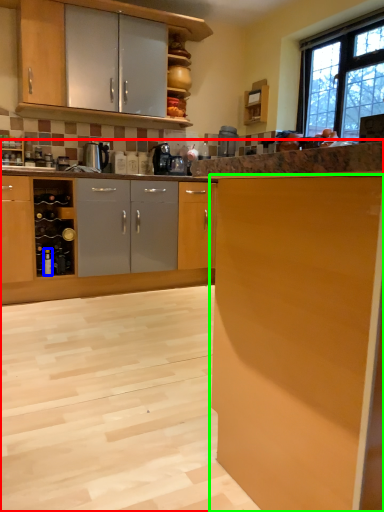
Question: Which object is positioned closest to cabinetry (highlighted by a red box)? Select from bottle (highlighted by a blue box) and cabinetry (highlighted by a green box).

Choices:
 (A) bottle
 (B) cabinetry

Answer: (B)